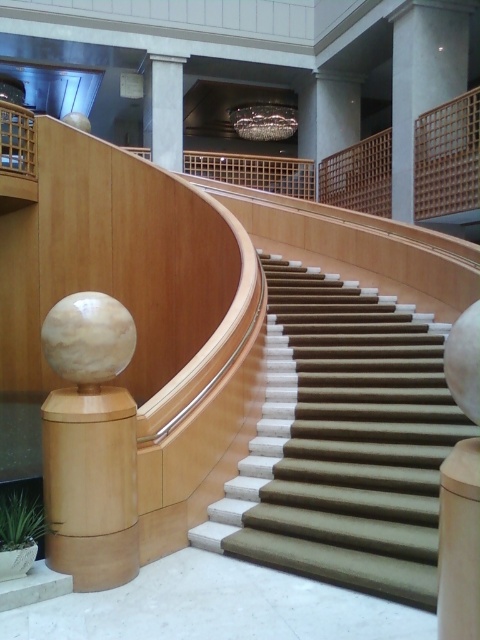
You are standing at the base of the staircase and want to locate the smooth concrete pillar at upper center. According to the coordinates provided, where should you look relative to the staircase?

The smooth concrete pillar at upper center is located at coordinates point (422, 77), which means it is positioned to the left and slightly above the center of the staircase area.

You are an interior designer assessing the staircase layout. You need to determine which object is closer to the entrance of the building. Based on the staircase design, which is closer to you between the smooth concrete pillar at upper center and the wooden post at center?

The smooth concrete pillar at upper center is closer to you than the wooden post at center, so it is closer to the entrance.

You are standing at the base of the staircase and want to locate the smooth concrete pillar at upper center. According to the coordinates provided, where should you look relative to the staircase?

A: The smooth concrete pillar at upper center is located at coordinates point (422,77), which means it is positioned slightly to the left and higher up relative to the staircase.